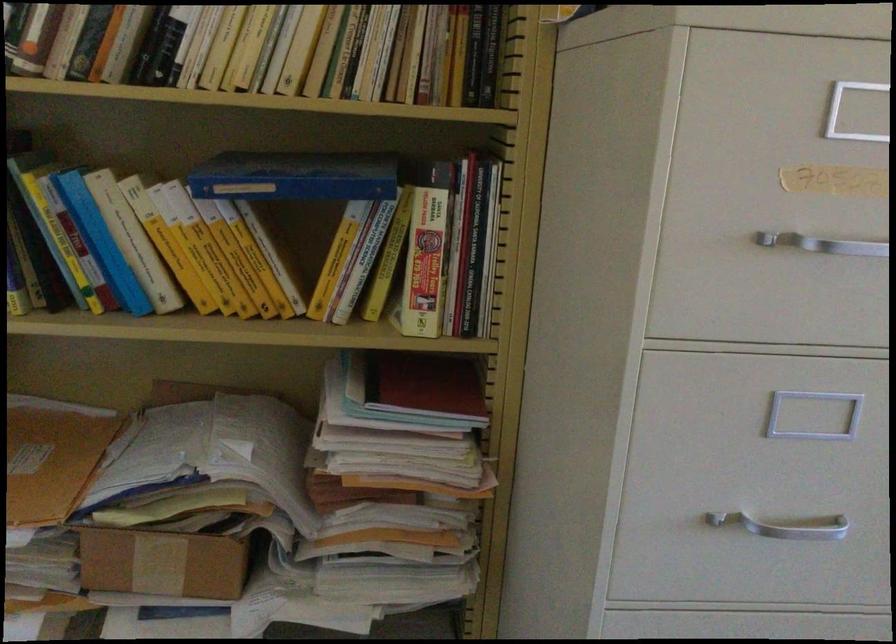
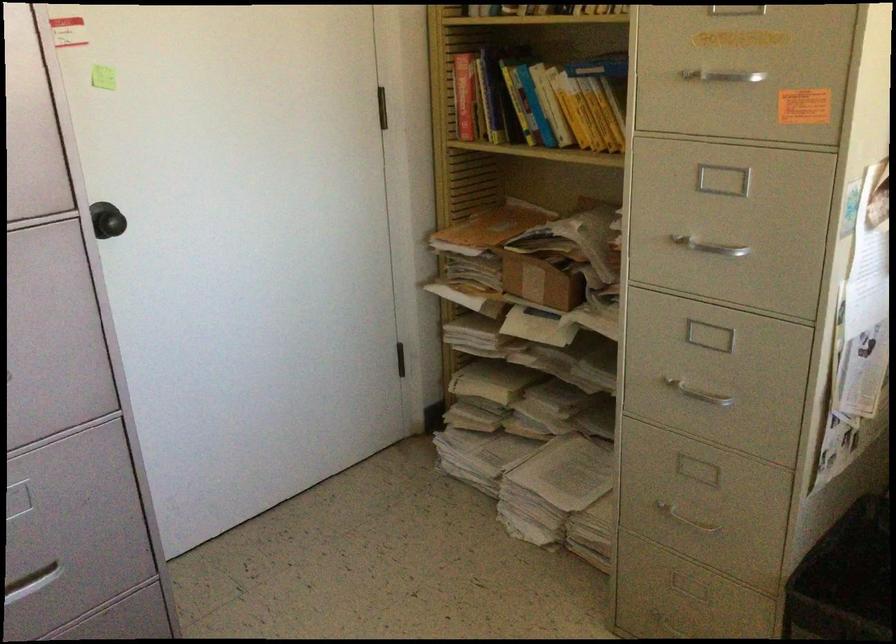
Where in the second image is the point corresponding to the point at 824,254 from the first image?

(725, 82)